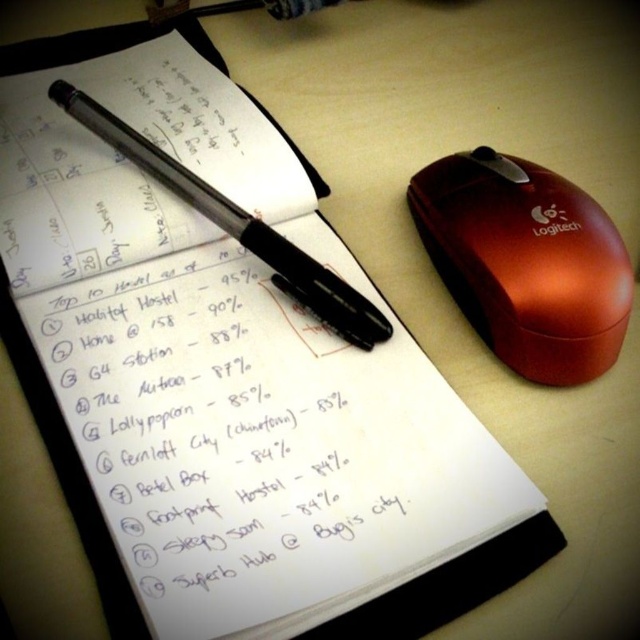
Question: Is white handwritten text at center below black glossy pen at upper left?

Choices:
 (A) no
 (B) yes

Answer: (B)

Question: From the image, what is the correct spatial relationship of shiny red mouse at right in relation to black glossy pen at upper left?

Choices:
 (A) right
 (B) left

Answer: (A)

Question: Which object appears closest to the camera in this image?

Choices:
 (A) white handwritten text at center
 (B) shiny red mouse at right
 (C) black glossy pen at upper left

Answer: (A)

Question: Which object appears farthest from the camera in this image?

Choices:
 (A) black glossy pen at upper left
 (B) white handwritten text at center

Answer: (A)

Question: Which object appears farthest from the camera in this image?

Choices:
 (A) black glossy pen at upper left
 (B) shiny red mouse at right

Answer: (A)

Question: Can you confirm if shiny red mouse at right is smaller than black glossy pen at upper left?

Choices:
 (A) yes
 (B) no

Answer: (B)